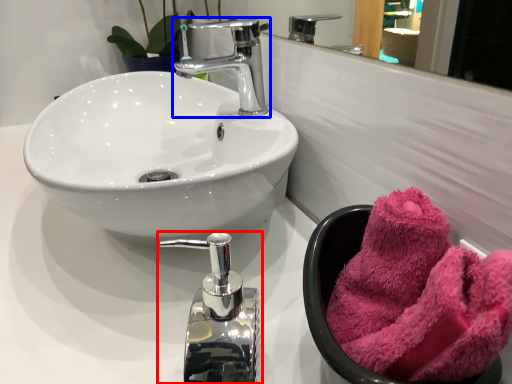
Question: Which object appears farthest to the camera in this image, tap (highlighted by a red box) or tap (highlighted by a blue box)?

Choices:
 (A) tap
 (B) tap

Answer: (B)